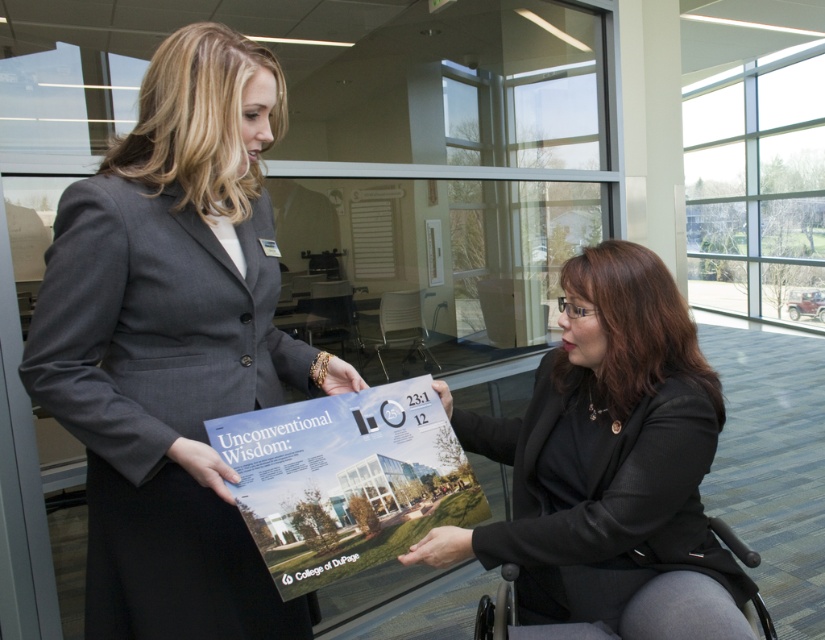
Question: Does matte gray blazer at center have a smaller size compared to black plastic wheelchair at lower right?

Choices:
 (A) yes
 (B) no

Answer: (B)

Question: Which point is closer to the camera?

Choices:
 (A) pos(92,228)
 (B) pos(748,547)
 (C) pos(555,612)

Answer: (A)

Question: Can you confirm if matte paper poster at center is positioned below black plastic wheelchair at lower right?

Choices:
 (A) no
 (B) yes

Answer: (A)

Question: Which point appears farthest from the camera in this image?

Choices:
 (A) (611, 356)
 (B) (497, 637)
 (C) (159, 419)
 (D) (347, 554)

Answer: (A)

Question: Does matte gray blazer at center appear under matte paper poster at center?

Choices:
 (A) yes
 (B) no

Answer: (B)

Question: Considering the real-world distances, which object is farthest from the matte paper poster at center?

Choices:
 (A) black textured blazer at center
 (B) matte gray blazer at center

Answer: (A)